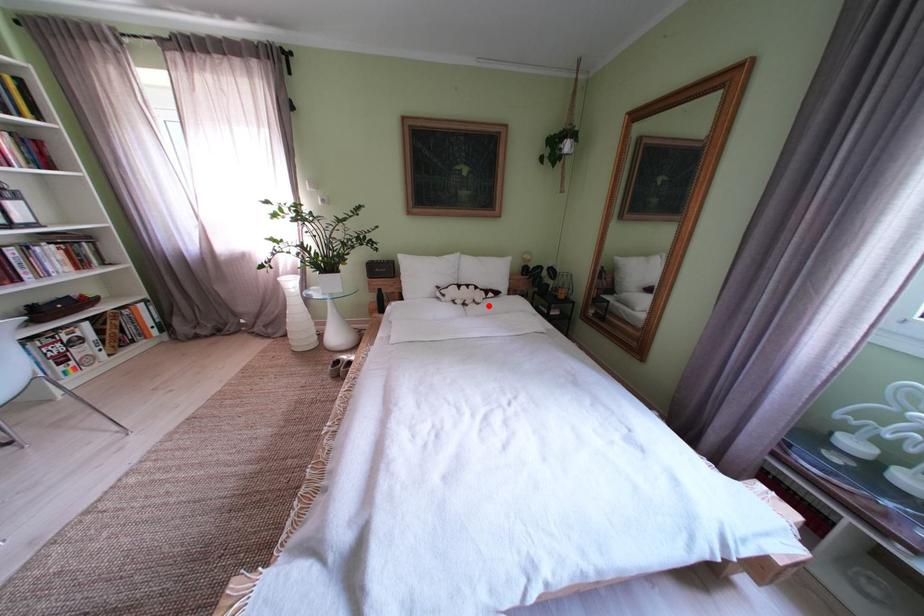
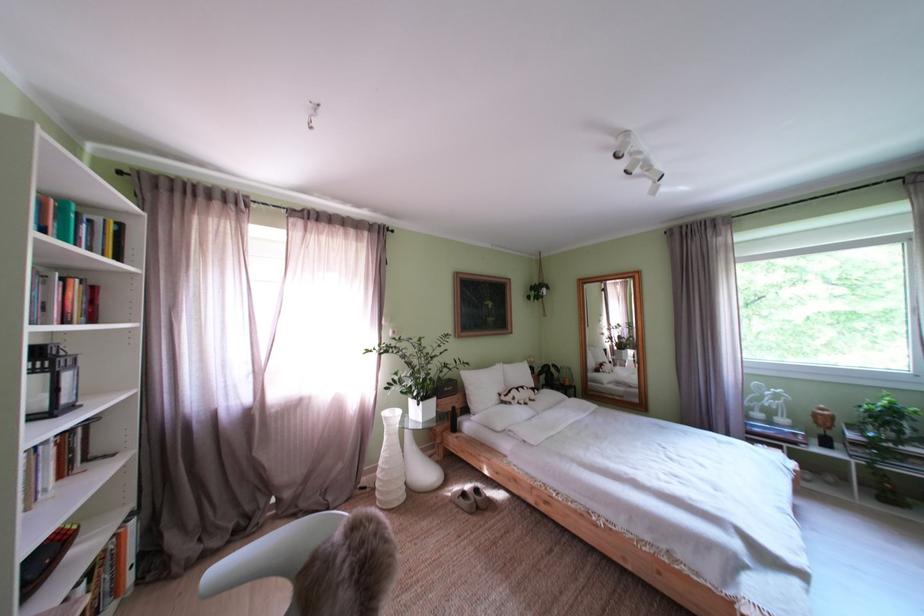
In the second image, find the point that corresponds to the highlighted location in the first image.

(543, 403)